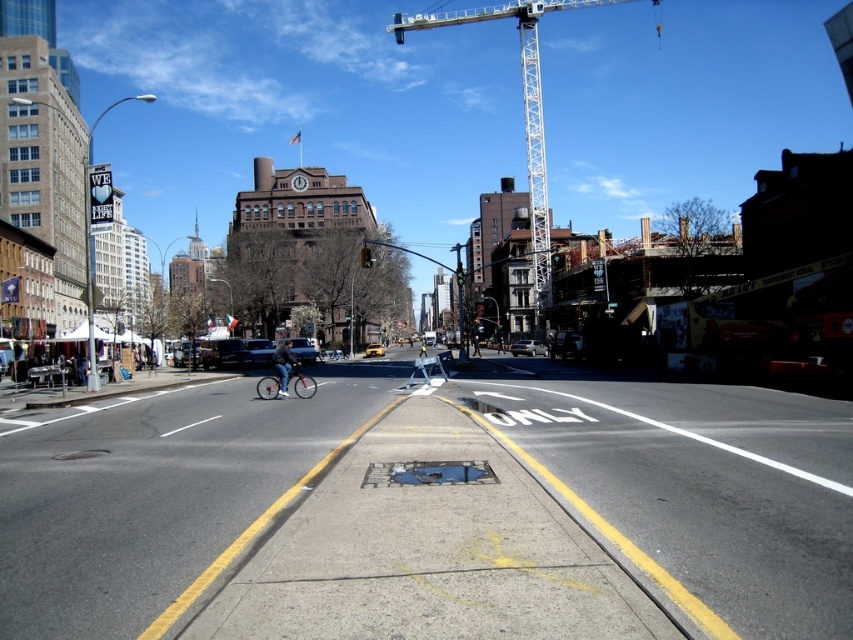
Question: In this image, where is white metallic crane at upper center located relative to denim jacket at center?

Choices:
 (A) right
 (B) left

Answer: (A)

Question: Which of the following is the closest to the observer?

Choices:
 (A) shiny silver bicycle at center
 (B) silver metallic sedan at center

Answer: (A)

Question: Can you confirm if white metallic crane at upper center is thinner than yellow rubber car at center?

Choices:
 (A) no
 (B) yes

Answer: (A)

Question: Can you confirm if white metallic crane at upper center is wider than silver metallic sedan at center?

Choices:
 (A) no
 (B) yes

Answer: (B)

Question: Considering the real-world distances, which object is closest to the silver metallic sedan at center?

Choices:
 (A) yellow rubber car at center
 (B) shiny silver bicycle at center

Answer: (A)

Question: Which of these objects is positioned closest to the metallic silver car at center?

Choices:
 (A) shiny silver bicycle at center
 (B) white metallic crane at upper center
 (C) silver metallic sedan at center

Answer: (C)